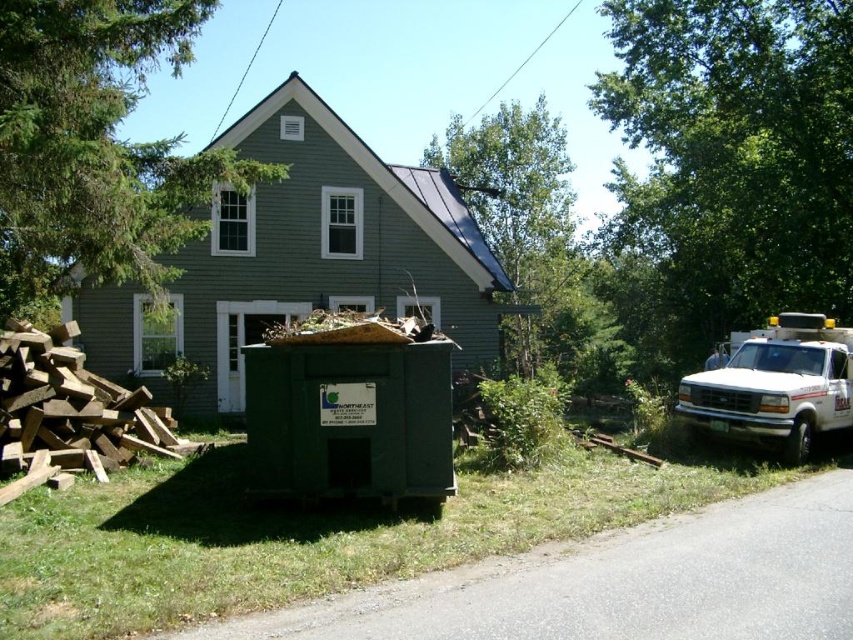
Question: Which point is closer to the camera?

Choices:
 (A) (700, 374)
 (B) (573, 264)
 (C) (15, 372)
 (D) (698, 292)

Answer: (C)

Question: Does green leafy tree at upper right have a larger size compared to brown rough wood at lower left?

Choices:
 (A) yes
 (B) no

Answer: (A)

Question: Considering the relative positions of green leafy tree at upper right and green leafy tree at upper left in the image provided, where is green leafy tree at upper right located with respect to green leafy tree at upper left?

Choices:
 (A) below
 (B) above

Answer: (B)

Question: Does brown rough wood at lower left come in front of white glossy truck at right?

Choices:
 (A) yes
 (B) no

Answer: (A)

Question: Among these objects, which one is nearest to the camera?

Choices:
 (A) green leafy tree at upper right
 (B) brown rough wood at lower left
 (C) green leafy tree at upper left

Answer: (C)

Question: Estimate the real-world distances between objects in this image. Which object is closer to the green leafy tree at upper right?

Choices:
 (A) green leafy tree at upper left
 (B) green leafy tree at upper center
 (C) brown rough wood at lower left

Answer: (B)